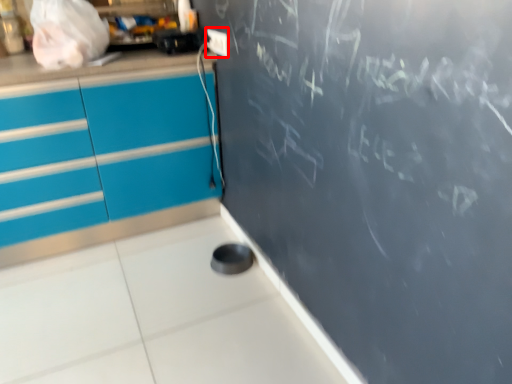
Question: Where is electric outlet (annotated by the red box) located in relation to appliance in the image?

Choices:
 (A) left
 (B) right

Answer: (B)